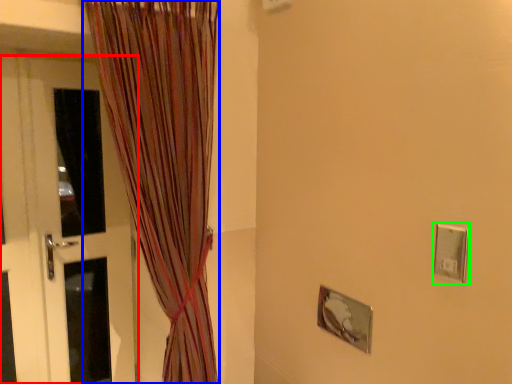
Question: Considering the real-world distances, which object is closest to door (highlighted by a red box)? curtain (highlighted by a blue box) or electric outlet (highlighted by a green box).

Choices:
 (A) curtain
 (B) electric outlet

Answer: (A)